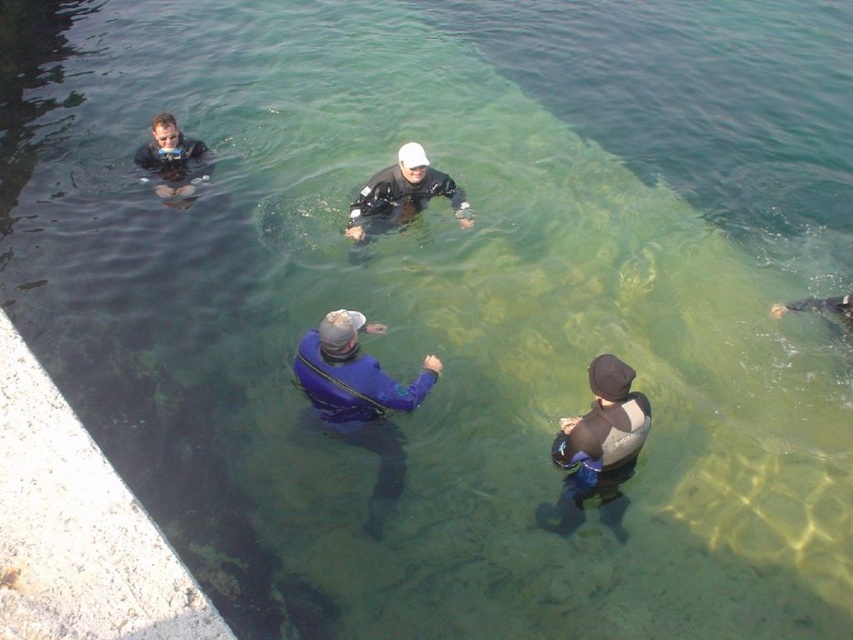
Consider the image. Who is shorter, blue neoprene wetsuit at center or gray neoprene wetsuit at lower center?

With less height is gray neoprene wetsuit at lower center.

Which is below, blue neoprene wetsuit at center or gray neoprene wetsuit at lower center?

gray neoprene wetsuit at lower center is below.

Image resolution: width=853 pixels, height=640 pixels. What do you see at coordinates (360, 397) in the screenshot? I see `blue neoprene wetsuit at center` at bounding box center [360, 397].

Where is `blue neoprene wetsuit at center`? This screenshot has width=853, height=640. blue neoprene wetsuit at center is located at coordinates (360, 397).

The width and height of the screenshot is (853, 640). Describe the element at coordinates (598, 449) in the screenshot. I see `gray neoprene wetsuit at lower center` at that location.

From the picture: Is gray neoprene wetsuit at lower center taller than matte black wetsuit at upper left?

Correct, gray neoprene wetsuit at lower center is much taller as matte black wetsuit at upper left.

Find the location of a particular element. gray neoprene wetsuit at lower center is located at coordinates (598, 449).

Measure the distance between blue neoprene wetsuit at center and camera.

blue neoprene wetsuit at center and camera are 6.45 meters apart.

Who is taller, blue neoprene wetsuit at center or matte black wetsuit at center?

blue neoprene wetsuit at center

This screenshot has height=640, width=853. Identify the location of blue neoprene wetsuit at center. (360, 397).